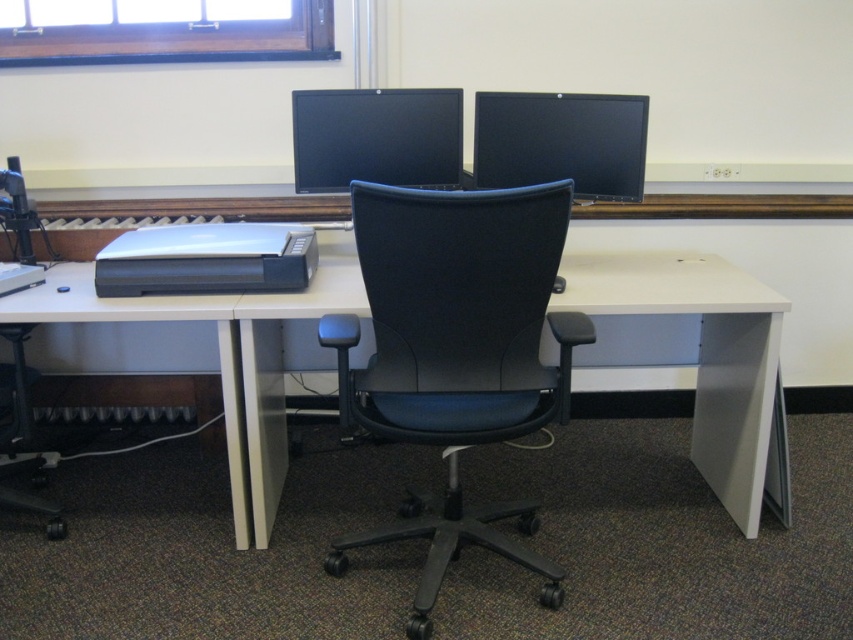
Question: Which object appears farthest from the camera in this image?

Choices:
 (A) silver/black printer at center
 (B) white plastic desk at center

Answer: (A)

Question: Is black fabric swivel chair at center below silver/black printer at center?

Choices:
 (A) no
 (B) yes

Answer: (B)

Question: Where is black fabric swivel chair at center located in relation to silver/black printer at center in the image?

Choices:
 (A) above
 (B) below

Answer: (B)

Question: Estimate the real-world distances between objects in this image. Which object is closer to the black fabric swivel chair at center?

Choices:
 (A) white plastic desk at center
 (B) black glossy monitor at center
 (C) silver/black printer at center

Answer: (A)

Question: Does black fabric swivel chair at center appear under white plastic desk at center?

Choices:
 (A) no
 (B) yes

Answer: (B)

Question: Which object is farther from the camera taking this photo?

Choices:
 (A) black fabric swivel chair at center
 (B) white plastic desk at center
 (C) black glossy monitor at center

Answer: (C)